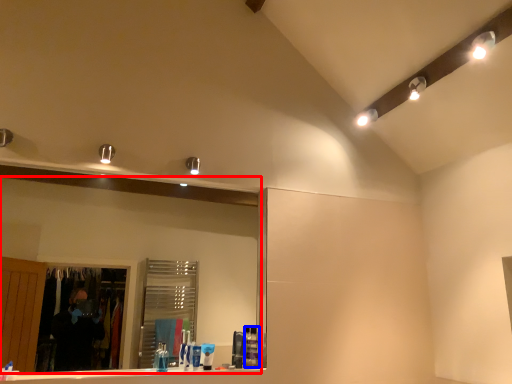
Question: Among these objects, which one is nearest to the camera, mirror (highlighted by a red box) or toiletry (highlighted by a blue box)?

Choices:
 (A) mirror
 (B) toiletry

Answer: (A)